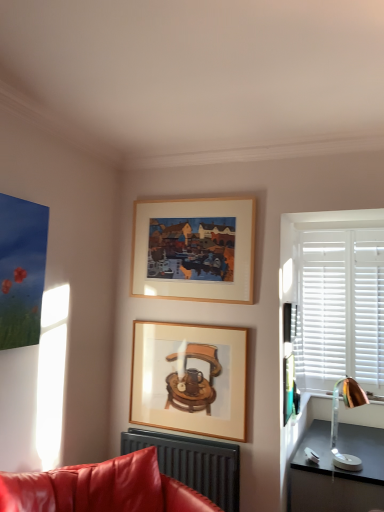
What do you see at coordinates (194, 249) in the screenshot? The height and width of the screenshot is (512, 384). I see `wooden frame at upper center, which ranks as the second picture frame in bottom-to-top order` at bounding box center [194, 249].

This screenshot has height=512, width=384. I want to click on copper metallic table lamp at right, so click(x=337, y=420).

From the image's perspective, between wooden frame at upper center, the 1th picture frame viewed from the top, and metallic gold lamp at right, which one is located above?

wooden frame at upper center, the 1th picture frame viewed from the top, appears higher in the image.

Is wooden frame at upper center, which ranks as the second picture frame in bottom-to-top order, directly adjacent to metallic gold lamp at right?

No, wooden frame at upper center, which ranks as the second picture frame in bottom-to-top order, is not touching metallic gold lamp at right.

Which is in front, point (168, 273) or point (337, 396)?

The point (168, 273) is more forward.

Is wooden frame at center, the second picture frame viewed from the top, in contact with copper metallic table lamp at right?

No.

Would you say wooden frame at center, placed as the first picture frame when sorted from bottom to top, contains copper metallic table lamp at right?

That's incorrect, copper metallic table lamp at right is not inside wooden frame at center, placed as the first picture frame when sorted from bottom to top.

From the image's perspective, is wooden frame at center, the second picture frame viewed from the top, on top of copper metallic table lamp at right?

Yes, from the image's perspective, wooden frame at center, the second picture frame viewed from the top, is above copper metallic table lamp at right.

Considering the relative sizes of metallic gold lamp at right and copper metallic table lamp at right in the image provided, is metallic gold lamp at right thinner than copper metallic table lamp at right?

Correct, the width of metallic gold lamp at right is less than that of copper metallic table lamp at right.

From a real-world perspective, is metallic gold lamp at right positioned over copper metallic table lamp at right based on gravity?

No.

Is metallic gold lamp at right next to copper metallic table lamp at right?

No, metallic gold lamp at right is not beside copper metallic table lamp at right.

Is the position of metallic gold lamp at right less distant than that of copper metallic table lamp at right?

No, it is behind copper metallic table lamp at right.

Is point (146, 294) in front of point (157, 436)?

No, (146, 294) is further to viewer.

Looking at the image, does wooden frame at upper center, the 1th picture frame viewed from the top, seem bigger or smaller compared to matte black radiator at lower center?

Clearly, wooden frame at upper center, the 1th picture frame viewed from the top, is smaller in size than matte black radiator at lower center.

How many degrees apart are the facing directions of wooden frame at upper center, which ranks as the second picture frame in bottom-to-top order, and matte black radiator at lower center?

There is a 0.000538-degree angle between the facing directions of wooden frame at upper center, which ranks as the second picture frame in bottom-to-top order, and matte black radiator at lower center.

In the scene shown: Is wooden frame at upper center, the 1th picture frame viewed from the top, with matte black radiator at lower center?

They are not placed beside each other.

From a real-world perspective, count 2nd picture frames upward from the metallic gold lamp at right and point to it. Please provide its 2D coordinates.

[(194, 249)]

Consider the image. Is wooden frame at upper center, which ranks as the second picture frame in bottom-to-top order, located within metallic gold lamp at right?

No, wooden frame at upper center, which ranks as the second picture frame in bottom-to-top order, is not inside metallic gold lamp at right.

Measure the distance between metallic gold lamp at right and wooden frame at upper center, the 1th picture frame viewed from the top.

metallic gold lamp at right and wooden frame at upper center, the 1th picture frame viewed from the top, are 2.00 meters apart from each other.

This screenshot has width=384, height=512. Identify the location of picture frame that appears on the right of wooden frame at center, the second picture frame viewed from the top. (194, 249).

Is wooden frame at center, placed as the first picture frame when sorted from bottom to top, positioned far away from wooden frame at upper center, which ranks as the second picture frame in bottom-to-top order?

They are positioned close to each other.

From the image's perspective, is wooden frame at center, the second picture frame viewed from the top, below wooden frame at upper center, which ranks as the second picture frame in bottom-to-top order?

Correct, wooden frame at center, the second picture frame viewed from the top, appears lower than wooden frame at upper center, which ranks as the second picture frame in bottom-to-top order, in the image.

Does point (176, 358) appear closer or farther from the camera than point (156, 289)?

Point (176, 358).

Is wooden frame at upper center, the 1th picture frame viewed from the top, in contact with wooden frame at center, the second picture frame viewed from the top?

No.

What's the angular difference between wooden frame at upper center, which ranks as the second picture frame in bottom-to-top order, and wooden frame at center, the second picture frame viewed from the top,'s facing directions?

wooden frame at upper center, which ranks as the second picture frame in bottom-to-top order, and wooden frame at center, the second picture frame viewed from the top, are facing 0.0089 degrees away from each other.

Is wooden frame at upper center, the 1th picture frame viewed from the top, positioned with its back to wooden frame at center, placed as the first picture frame when sorted from bottom to top?

No, wooden frame at upper center, the 1th picture frame viewed from the top, is not facing the opposite direction of wooden frame at center, placed as the first picture frame when sorted from bottom to top.

Does wooden frame at upper center, which ranks as the second picture frame in bottom-to-top order, lie behind wooden frame at center, the second picture frame viewed from the top?

Yes, it is behind wooden frame at center, the second picture frame viewed from the top.

At what (x,y) coordinates should I click in order to perform the action: click on window sill that is on the right side of wooden frame at upper center, which ranks as the second picture frame in bottom-to-top order. Please return your answer as a coordinate pair (x, y). The image size is (384, 512). Looking at the image, I should click on (374, 397).

The width and height of the screenshot is (384, 512). I want to click on the 2nd picture frame counting from the left side of the copper metallic table lamp at right, so click(x=190, y=379).

From the image, which object appears to be farther from wooden frame at center, the second picture frame viewed from the top, metallic gold lamp at right or copper metallic table lamp at right?

metallic gold lamp at right is further to wooden frame at center, the second picture frame viewed from the top.

From the image, which object appears to be farther from wooden frame at upper center, which ranks as the second picture frame in bottom-to-top order, matte black radiator at lower center or metallic gold lamp at right?

The object further to wooden frame at upper center, which ranks as the second picture frame in bottom-to-top order, is metallic gold lamp at right.

Based on their spatial positions, is wooden frame at center, the second picture frame viewed from the top, or matte black radiator at lower center closer to copper metallic table lamp at right?

Among the two, matte black radiator at lower center is located nearer to copper metallic table lamp at right.

Estimate the real-world distances between objects in this image. Which object is further from wooden frame at upper center, the 1th picture frame viewed from the top, copper metallic table lamp at right or matte black radiator at lower center?

copper metallic table lamp at right is positioned further to the anchor wooden frame at upper center, the 1th picture frame viewed from the top.

Based on their spatial positions, is wooden frame at upper center, the 1th picture frame viewed from the top, or copper metallic table lamp at right further from metallic gold lamp at right?

wooden frame at upper center, the 1th picture frame viewed from the top, is positioned further to the anchor metallic gold lamp at right.

Which object lies further to the anchor point copper metallic table lamp at right, matte black radiator at lower center or metallic gold lamp at right?

The object further to copper metallic table lamp at right is matte black radiator at lower center.

When comparing their distances from copper metallic table lamp at right, does wooden frame at center, placed as the first picture frame when sorted from bottom to top, or metallic gold lamp at right seem further?

The object further to copper metallic table lamp at right is wooden frame at center, placed as the first picture frame when sorted from bottom to top.

Looking at the image, which one is located further to wooden frame at upper center, which ranks as the second picture frame in bottom-to-top order, wooden frame at center, placed as the first picture frame when sorted from bottom to top, or matte black radiator at lower center?

Among the two, matte black radiator at lower center is located further to wooden frame at upper center, which ranks as the second picture frame in bottom-to-top order.

At what (x,y) coordinates should I click in order to perform the action: click on table lamp between wooden frame at upper center, which ranks as the second picture frame in bottom-to-top order, and matte black radiator at lower center from top to bottom. Please return your answer as a coordinate pair (x, y). This screenshot has height=512, width=384. Looking at the image, I should click on (337, 420).

Find the location of a particular element. This screenshot has width=384, height=512. table lamp between wooden frame at center, placed as the first picture frame when sorted from bottom to top, and metallic gold lamp at right, in the horizontal direction is located at coordinates (337, 420).

Identify the location of window sill between wooden frame at upper center, which ranks as the second picture frame in bottom-to-top order, and matte black radiator at lower center from top to bottom. (374, 397).

At what (x,y) coordinates should I click in order to perform the action: click on table lamp located between wooden frame at upper center, which ranks as the second picture frame in bottom-to-top order, and metallic gold lamp at right in the left-right direction. Please return your answer as a coordinate pair (x, y). Looking at the image, I should click on (337, 420).